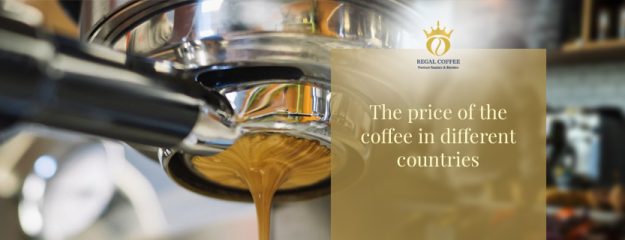
The width and height of the screenshot is (625, 240). In order to click on shelves in this screenshot , I will do `click(602, 45)`, `click(572, 44)`.